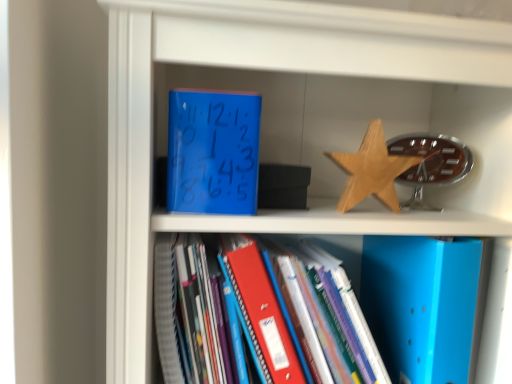
Question: From the image's perspective, is wooden star at upper right located above or below blue matte clock at upper center, the second paperback book in the right-to-left sequence?

Choices:
 (A) above
 (B) below

Answer: (B)

Question: From a real-world perspective, is wooden star at upper right above or below blue matte clock at upper center, the first paperback book from the top?

Choices:
 (A) below
 (B) above

Answer: (A)

Question: Which of these objects is positioned closest to the wooden star at upper right?

Choices:
 (A) blue matte folder at lower right, which ranks as the second paperback book in left-to-right order
 (B) blue matte folder at center
 (C) blue matte clock at upper center, the first paperback book from the top

Answer: (A)

Question: Based on their relative distances, which object is nearer to the blue matte folder at lower right, the first paperback book ordered from the bottom?

Choices:
 (A) blue matte clock at upper center, which is the 1th paperback book in left-to-right order
 (B) wooden star at upper right
 (C) blue matte folder at center

Answer: (B)